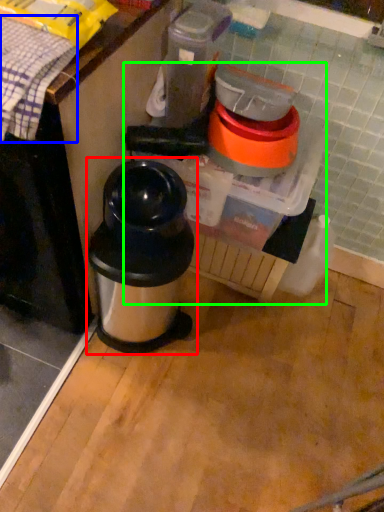
Question: Considering the real-world distances, which object is farthest from waste container (highlighted by a red box)? blanket (highlighted by a blue box) or blender (highlighted by a green box)?

Choices:
 (A) blanket
 (B) blender

Answer: (A)